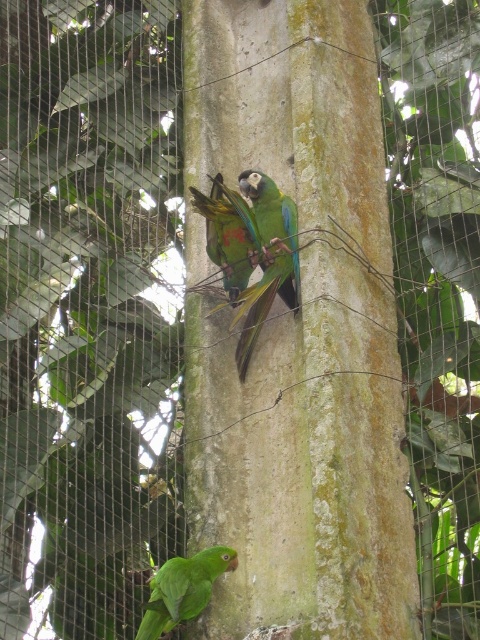
Looking at this image, who is positioned more to the right, blue-green feathers parrot at center or multicolored feathers parrot at center?

blue-green feathers parrot at center

Is blue-green feathers parrot at center smaller than multicolored feathers parrot at center?

Actually, blue-green feathers parrot at center might be larger than multicolored feathers parrot at center.

Which is in front, point (266, 236) or point (240, 275)?

Point (266, 236)

You are a GUI agent. You are given a task and a screenshot of the screen. Output one action in this format:
    pyautogui.click(x=<x>, y=<y>)
    Task: Click on the blue-green feathers parrot at center
    
    Given the screenshot: What is the action you would take?
    [267, 259]

Which is in front, point (144, 627) or point (225, 282)?

Point (144, 627)

Between green matte parrot at lower left and multicolored feathers parrot at center, which one appears on the left side from the viewer's perspective?

green matte parrot at lower left is more to the left.

This screenshot has height=640, width=480. I want to click on green matte parrot at lower left, so click(x=182, y=589).

This screenshot has height=640, width=480. What do you see at coordinates (267, 259) in the screenshot?
I see `blue-green feathers parrot at center` at bounding box center [267, 259].

Does blue-green feathers parrot at center appear over green matte parrot at lower left?

Correct, blue-green feathers parrot at center is located above green matte parrot at lower left.

Identify the location of blue-green feathers parrot at center. The height and width of the screenshot is (640, 480). (267, 259).